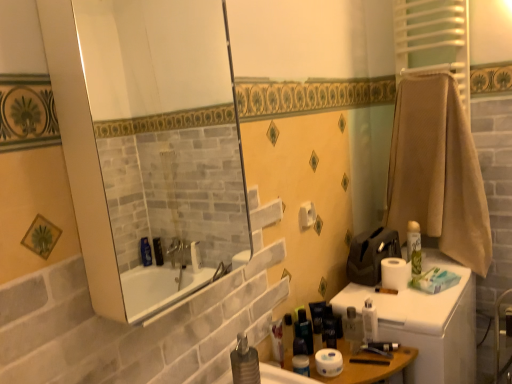
The image size is (512, 384). Identify the location of vacant space in front of white matte toilet paper at right, acting as the second toilet paper starting from the bottom. (428, 311).